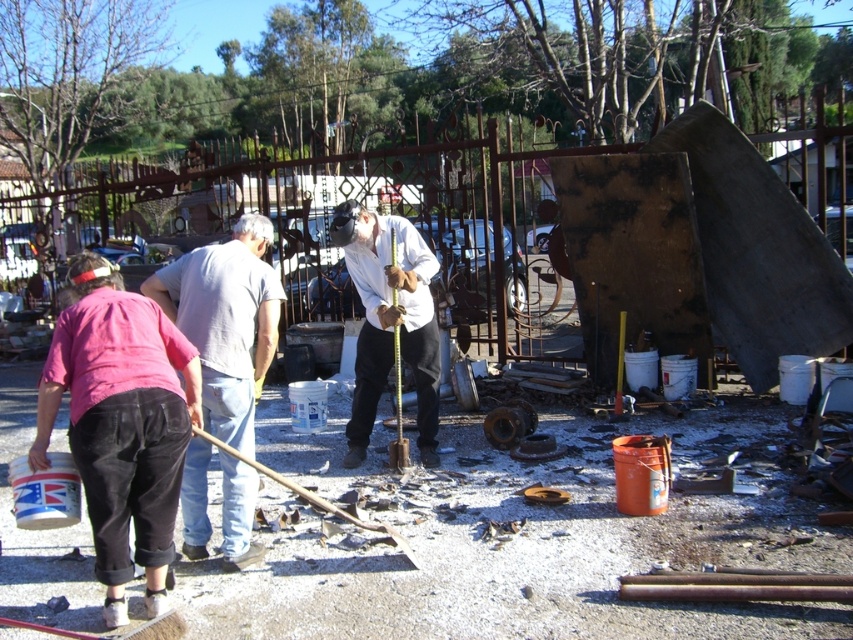
Question: Among these points, which one is nearest to the camera?

Choices:
 (A) (109, 529)
 (B) (200, 256)

Answer: (A)

Question: Can you confirm if pink fabric shirt at lower left is positioned above white matte shirt at center?

Choices:
 (A) yes
 (B) no

Answer: (B)

Question: Among these points, which one is farthest from the camera?

Choices:
 (A) [425, 380]
 (B) [236, 497]
 (C) [236, 632]
 (D) [96, 326]

Answer: (A)

Question: Does pink fabric shirt at lower left have a greater width compared to gray cotton shirt at center?

Choices:
 (A) yes
 (B) no

Answer: (B)

Question: Can you confirm if pink fabric shirt at lower left is bigger than gray cotton shirt at center?

Choices:
 (A) no
 (B) yes

Answer: (A)

Question: Which of the following is the farthest from the observer?

Choices:
 (A) (180, 308)
 (B) (428, 307)
 (C) (459, 493)
 (D) (62, 314)

Answer: (B)